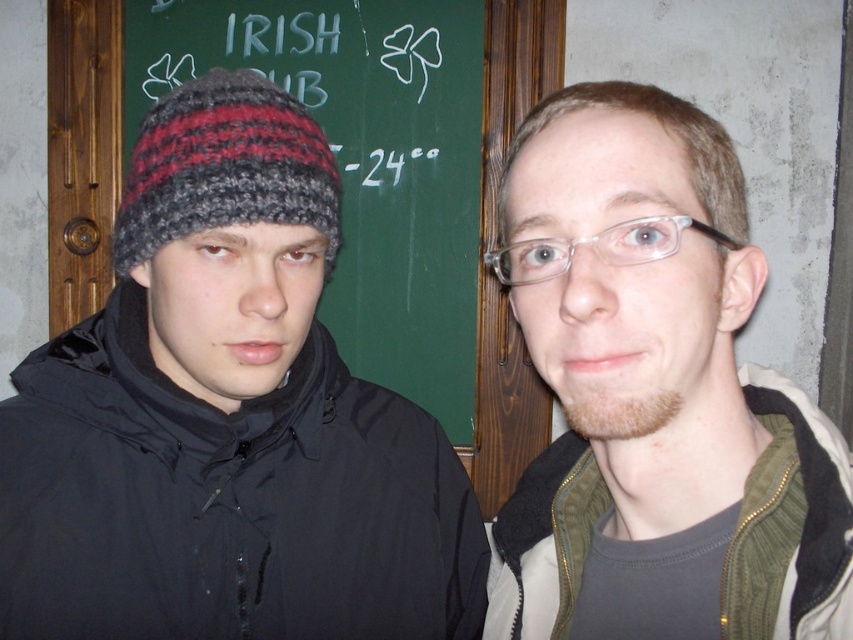
Which is in front, point (672, 125) or point (126, 260)?

Positioned in front is point (672, 125).

Is matte green jacket at center shorter than knitted woolen beanie at left?

No, matte green jacket at center is not shorter than knitted woolen beanie at left.

Where is `matte green jacket at center`? The width and height of the screenshot is (853, 640). matte green jacket at center is located at coordinates (656, 394).

Does green chalkboard at upper center have a greater width compared to knitted woolen beanie at left?

Yes.

Identify the location of green chalkboard at upper center. (363, 161).

Between point (358, 188) and point (215, 184), which one is positioned in front?

Point (215, 184) is more forward.

Where is `green chalkboard at upper center`? This screenshot has width=853, height=640. green chalkboard at upper center is located at coordinates (363, 161).

Can you confirm if knitted woolen hat at left is bigger than green chalkboard at upper center?

Actually, knitted woolen hat at left might be smaller than green chalkboard at upper center.

Between point (192, 275) and point (354, 355), which one is positioned behind?

Point (354, 355)

The width and height of the screenshot is (853, 640). In order to click on knitted woolen hat at left in this screenshot , I will do [225, 419].